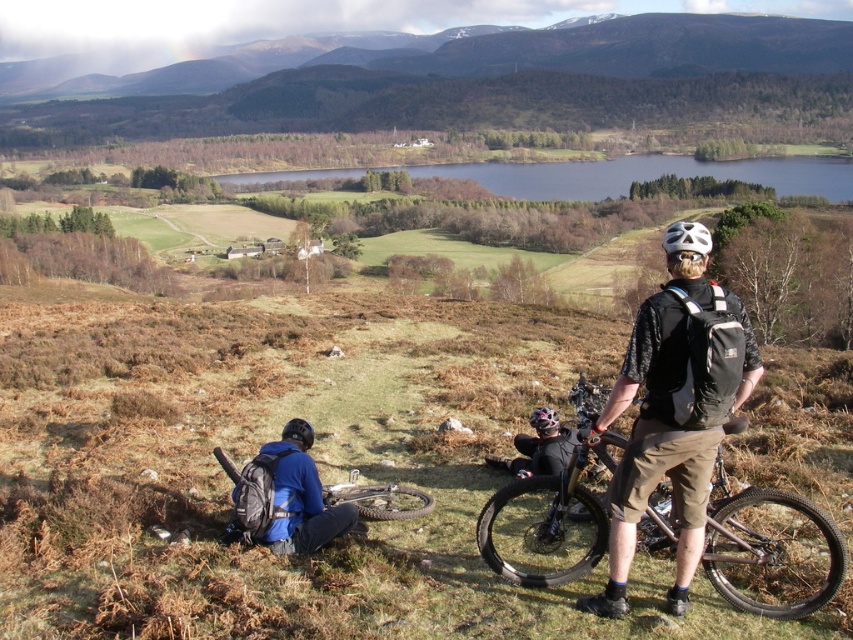
Does matte black bicycle at right appear over matte black helmet at center?

Actually, matte black bicycle at right is below matte black helmet at center.

Who is more distant from viewer, (589, 516) or (531, 412)?

The point (531, 412) is more distant.

Locate an element on the screen. matte black bicycle at right is located at coordinates (770, 548).

Which is more to the left, green grassy lake at center or matte black mountain bike at lower left?

From the viewer's perspective, matte black mountain bike at lower left appears more on the left side.

In order to click on green grassy lake at center in this screenshot , I will do `click(645, 176)`.

Which of these two, matte black bicycle at right or blue fabric jacket at lower left, stands taller?

matte black bicycle at right

Between point (775, 518) and point (325, 540), which one is positioned in front?

Point (325, 540)

Find the location of a particular element. The width and height of the screenshot is (853, 640). matte black bicycle at right is located at coordinates (770, 548).

This screenshot has height=640, width=853. What are the coordinates of `matte black bicycle at right` in the screenshot? It's located at (770, 548).